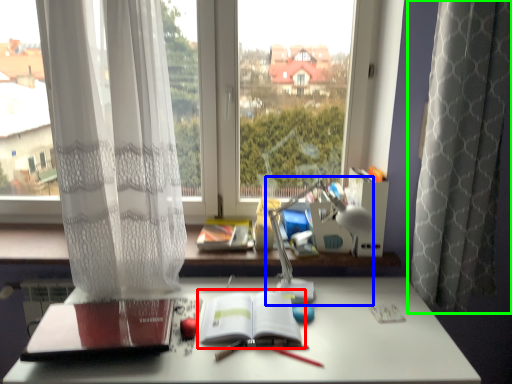
Question: Which object is the closest to the paperback book (highlighted by a red box)? Choose among these: table lamp (highlighted by a blue box) or curtain (highlighted by a green box).

Choices:
 (A) table lamp
 (B) curtain

Answer: (A)